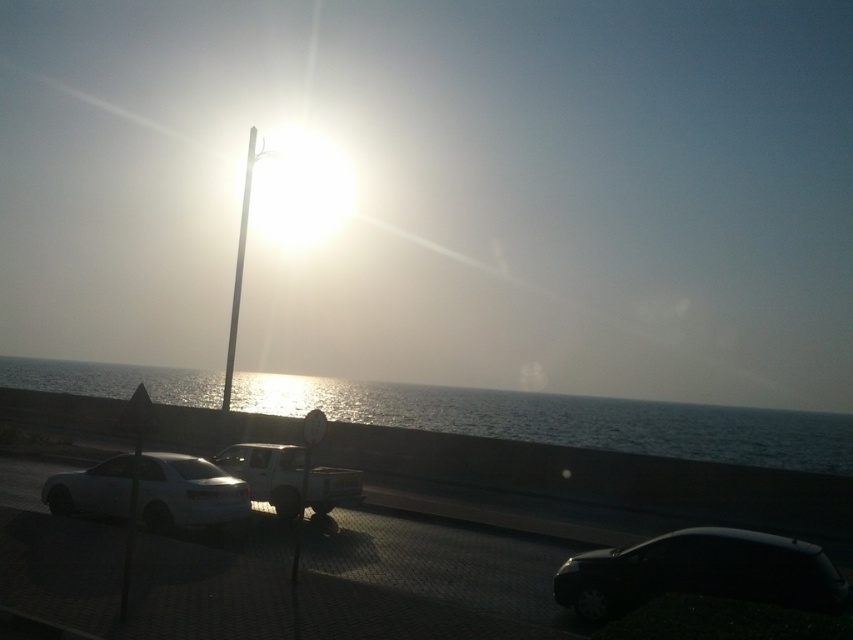
Question: Does white matte truck at center appear on the right side of white glossy pole at center?

Choices:
 (A) yes
 (B) no

Answer: (A)

Question: Which point appears closest to the camera in this image?

Choices:
 (A) (697, 547)
 (B) (59, 497)
 (C) (239, 218)
 (D) (306, 497)

Answer: (A)

Question: Which object is farther from the camera taking this photo?

Choices:
 (A) white matte sedan at lower left
 (B) black glossy car at lower right
 (C) white matte truck at center

Answer: (C)

Question: Can you confirm if glistening water at center is wider than black glossy car at lower right?

Choices:
 (A) no
 (B) yes

Answer: (B)

Question: Does glistening water at center lie in front of white matte truck at center?

Choices:
 (A) yes
 (B) no

Answer: (B)

Question: Which of the following is the farthest from the observer?

Choices:
 (A) black glossy car at lower right
 (B) white matte sedan at lower left
 (C) glistening water at center

Answer: (C)